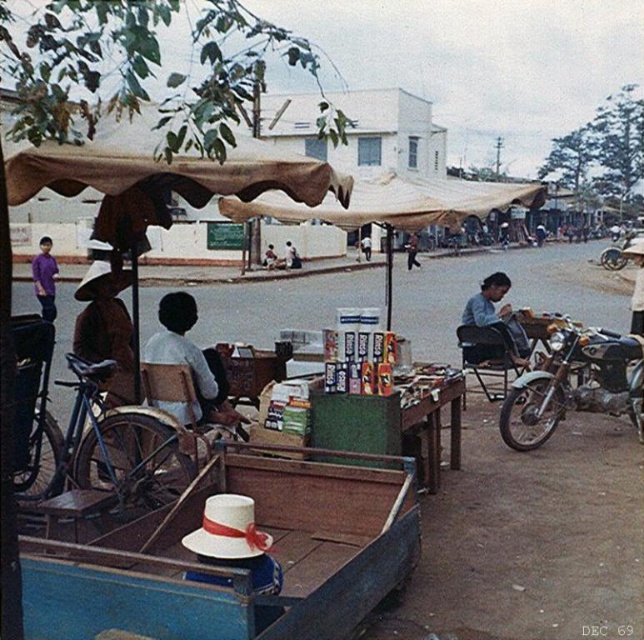
Based on the photo, you are standing at the point with coordinates point (41,280) and want to walk towards the point with coordinates point (516,346). Based on the scene description, will you have to walk forward or backward to reach your destination?

Since point (516,346) is in front of point (41,280), you will need to walk forward to reach it.

You are a customer browsing the items on the wooden cart. You see the blue denim shirt at center and the purple cotton shirt at left. Which shirt is shorter in height?

The blue denim shirt at center is shorter than the purple cotton shirt at left.